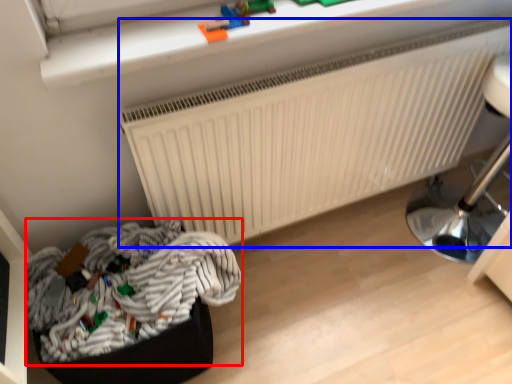
Question: Which object appears farthest to the camera in this image, laundry (highlighted by a red box) or radiator (highlighted by a blue box)?

Choices:
 (A) laundry
 (B) radiator

Answer: (B)